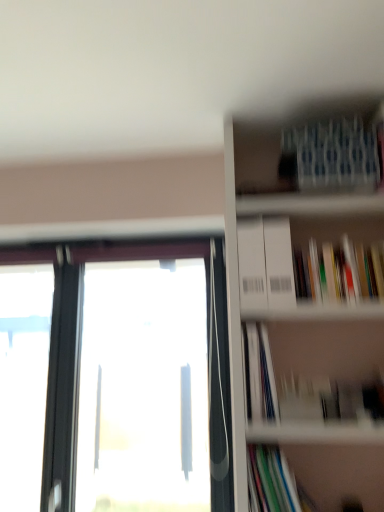
The width and height of the screenshot is (384, 512). Describe the element at coordinates (261, 374) in the screenshot. I see `white paper at center-right, which ranks as the second book in bottom-to-top order` at that location.

Describe the element at coordinates (114, 379) in the screenshot. The image size is (384, 512). I see `transparent glass window at left` at that location.

The height and width of the screenshot is (512, 384). What do you see at coordinates (333, 156) in the screenshot?
I see `blue textured fabric at upper right, the fourth book in the bottom-to-top sequence` at bounding box center [333, 156].

At what (x,y) coordinates should I click in order to perform the action: click on white cardboard bookcase at upper right. Please return your answer as a coordinate pair (x, y). Looking at the image, I should click on pyautogui.click(x=309, y=296).

What do you see at coordinates (274, 483) in the screenshot?
I see `multicolored paper at lower right, placed as the fourth book when sorted from top to bottom` at bounding box center [274, 483].

Identify the location of white paper at center-right, which ranks as the second book in bottom-to-top order. (261, 374).

Is multicolored paperbacks at upper right, the third book ordered from the bottom, positioned before white paper at center-right, which ranks as the second book in bottom-to-top order?

No, it is not.

Considering the sizes of objects multicolored paperbacks at upper right, the third book ordered from the bottom, and white paper at center-right, which is counted as the third book, starting from the top, in the image provided, who is smaller, multicolored paperbacks at upper right, the third book ordered from the bottom, or white paper at center-right, which is counted as the third book, starting from the top,?

With smaller size is white paper at center-right, which is counted as the third book, starting from the top.

From the image's perspective, is multicolored paperbacks at upper right, the third book ordered from the bottom, on transparent glass window at left?

Indeed, from the image's perspective, multicolored paperbacks at upper right, the third book ordered from the bottom, is shown above transparent glass window at left.

From a real-world perspective, is multicolored paperbacks at upper right, marked as the 2th book in a top-to-bottom arrangement, under transparent glass window at left?

No, from a real-world perspective, multicolored paperbacks at upper right, marked as the 2th book in a top-to-bottom arrangement, is not below transparent glass window at left.

Measure the distance between white paper at center-right, which ranks as the second book in bottom-to-top order, and multicolored paperbacks at upper right, the third book ordered from the bottom.

white paper at center-right, which ranks as the second book in bottom-to-top order, is 13.03 inches from multicolored paperbacks at upper right, the third book ordered from the bottom.

Considering the relative sizes of white paper at center-right, which is counted as the third book, starting from the top, and multicolored paperbacks at upper right, the third book ordered from the bottom, in the image provided, is white paper at center-right, which is counted as the third book, starting from the top, wider than multicolored paperbacks at upper right, the third book ordered from the bottom,?

Yes, white paper at center-right, which is counted as the third book, starting from the top, is wider than multicolored paperbacks at upper right, the third book ordered from the bottom.

Which point is more forward, (269,415) or (381,250)?

The point (269,415) is more forward.

Is white paper at center-right, which ranks as the second book in bottom-to-top order, turned away from multicolored paperbacks at upper right, marked as the 2th book in a top-to-bottom arrangement?

No, white paper at center-right, which ranks as the second book in bottom-to-top order, is not facing away from multicolored paperbacks at upper right, marked as the 2th book in a top-to-bottom arrangement.

From a real-world perspective, is multicolored paperbacks at upper right, the third book ordered from the bottom, physically located above or below multicolored paper at lower right, which is counted as the 1th book, starting from the bottom?

multicolored paperbacks at upper right, the third book ordered from the bottom, is above multicolored paper at lower right, which is counted as the 1th book, starting from the bottom.

Considering the relative sizes of multicolored paperbacks at upper right, marked as the 2th book in a top-to-bottom arrangement, and multicolored paper at lower right, which is counted as the 1th book, starting from the bottom, in the image provided, is multicolored paperbacks at upper right, marked as the 2th book in a top-to-bottom arrangement, bigger than multicolored paper at lower right, which is counted as the 1th book, starting from the bottom,?

Indeed, multicolored paperbacks at upper right, marked as the 2th book in a top-to-bottom arrangement, has a larger size compared to multicolored paper at lower right, which is counted as the 1th book, starting from the bottom.

Which of these two, multicolored paperbacks at upper right, marked as the 2th book in a top-to-bottom arrangement, or multicolored paper at lower right, placed as the fourth book when sorted from top to bottom, stands taller?

With more height is multicolored paperbacks at upper right, marked as the 2th book in a top-to-bottom arrangement.

From the image's perspective, is multicolored paperbacks at upper right, marked as the 2th book in a top-to-bottom arrangement, on top of multicolored paper at lower right, placed as the fourth book when sorted from top to bottom?

Correct, multicolored paperbacks at upper right, marked as the 2th book in a top-to-bottom arrangement, appears higher than multicolored paper at lower right, placed as the fourth book when sorted from top to bottom, in the image.

From a real-world perspective, who is located lower, white cardboard bookcase at upper right or transparent glass window at left?

transparent glass window at left.

Choose the correct answer: Is white cardboard bookcase at upper right inside transparent glass window at left or outside it?

white cardboard bookcase at upper right is not enclosed by transparent glass window at left.

How distant is white cardboard bookcase at upper right from transparent glass window at left?

25.66 inches.

Is white cardboard bookcase at upper right far away from transparent glass window at left?

No, white cardboard bookcase at upper right is in close proximity to transparent glass window at left.

From a real-world perspective, which object rests below the other?

transparent glass window at left.

Can you confirm if white paper at center-right, which is counted as the third book, starting from the top, is shorter than transparent glass window at left?

Correct, white paper at center-right, which is counted as the third book, starting from the top, is not as tall as transparent glass window at left.

Is white paper at center-right, which is counted as the third book, starting from the top, closer to camera compared to transparent glass window at left?

Result: Yes, white paper at center-right, which is counted as the third book, starting from the top, is in front of transparent glass window at left.

From the image's perspective, which is above, white paper at center-right, which ranks as the second book in bottom-to-top order, or transparent glass window at left?

white paper at center-right, which ranks as the second book in bottom-to-top order, appears higher in the image.

Considering their positions, is blue textured fabric at upper right, the 1th book positioned from the top, located in front of or behind white cardboard bookcase at upper right?

Visually, blue textured fabric at upper right, the 1th book positioned from the top, is located behind white cardboard bookcase at upper right.

I want to click on book that is the 2nd one above the white cardboard bookcase at upper right (from a real-world perspective), so click(333, 156).

I want to click on the 1st book above the white paper at center-right, which ranks as the second book in bottom-to-top order (from a real-world perspective), so click(339, 271).

At what (x,y) coordinates should I click in order to perform the action: click on window below the multicolored paperbacks at upper right, the third book ordered from the bottom (from a real-world perspective). Please return your answer as a coordinate pair (x, y). Looking at the image, I should click on (114, 379).

Looking at the image, which one is located closer to white paper at center-right, which ranks as the second book in bottom-to-top order, transparent glass window at left or blue textured fabric at upper right, the 1th book positioned from the top?

Based on the image, blue textured fabric at upper right, the 1th book positioned from the top, appears to be nearer to white paper at center-right, which ranks as the second book in bottom-to-top order.

Looking at the image, which one is located further to multicolored paperbacks at upper right, marked as the 2th book in a top-to-bottom arrangement, white paper at center-right, which is counted as the third book, starting from the top, or blue textured fabric at upper right, the fourth book in the bottom-to-top sequence?

white paper at center-right, which is counted as the third book, starting from the top, is further to multicolored paperbacks at upper right, marked as the 2th book in a top-to-bottom arrangement.

Looking at the image, which one is located further to white cardboard bookcase at upper right, blue textured fabric at upper right, the 1th book positioned from the top, or multicolored paperbacks at upper right, marked as the 2th book in a top-to-bottom arrangement?

The object further to white cardboard bookcase at upper right is blue textured fabric at upper right, the 1th book positioned from the top.

When comparing their distances from multicolored paperbacks at upper right, marked as the 2th book in a top-to-bottom arrangement, does transparent glass window at left or white cardboard bookcase at upper right seem closer?

Based on the image, white cardboard bookcase at upper right appears to be nearer to multicolored paperbacks at upper right, marked as the 2th book in a top-to-bottom arrangement.

Based on their spatial positions, is multicolored paper at lower right, placed as the fourth book when sorted from top to bottom, or white cardboard bookcase at upper right closer to transparent glass window at left?

Based on the image, white cardboard bookcase at upper right appears to be nearer to transparent glass window at left.

Looking at the image, which one is located further to multicolored paperbacks at upper right, the third book ordered from the bottom, multicolored paper at lower right, placed as the fourth book when sorted from top to bottom, or blue textured fabric at upper right, the 1th book positioned from the top?

The object further to multicolored paperbacks at upper right, the third book ordered from the bottom, is multicolored paper at lower right, placed as the fourth book when sorted from top to bottom.

Which object lies nearer to the anchor point transparent glass window at left, multicolored paperbacks at upper right, the third book ordered from the bottom, or multicolored paper at lower right, which is counted as the 1th book, starting from the bottom?

multicolored paper at lower right, which is counted as the 1th book, starting from the bottom.

Looking at the image, which one is located closer to multicolored paper at lower right, which is counted as the 1th book, starting from the bottom, transparent glass window at left or multicolored paperbacks at upper right, marked as the 2th book in a top-to-bottom arrangement?

multicolored paperbacks at upper right, marked as the 2th book in a top-to-bottom arrangement, lies closer to multicolored paper at lower right, which is counted as the 1th book, starting from the bottom, than the other object.

I want to click on book between multicolored paperbacks at upper right, the third book ordered from the bottom, and multicolored paper at lower right, placed as the fourth book when sorted from top to bottom, from top to bottom, so click(261, 374).

At what (x,y) coordinates should I click in order to perform the action: click on book that lies between blue textured fabric at upper right, the 1th book positioned from the top, and white paper at center-right, which is counted as the third book, starting from the top, from top to bottom. Please return your answer as a coordinate pair (x, y). The height and width of the screenshot is (512, 384). Looking at the image, I should click on (339, 271).

At what (x,y) coordinates should I click in order to perform the action: click on book that lies between blue textured fabric at upper right, the fourth book in the bottom-to-top sequence, and white cardboard bookcase at upper right from top to bottom. Please return your answer as a coordinate pair (x, y). Looking at the image, I should click on (339, 271).

Find the location of a particular element. The width and height of the screenshot is (384, 512). book between transparent glass window at left and multicolored paper at lower right, placed as the fourth book when sorted from top to bottom, from left to right is located at coordinates pyautogui.click(x=261, y=374).